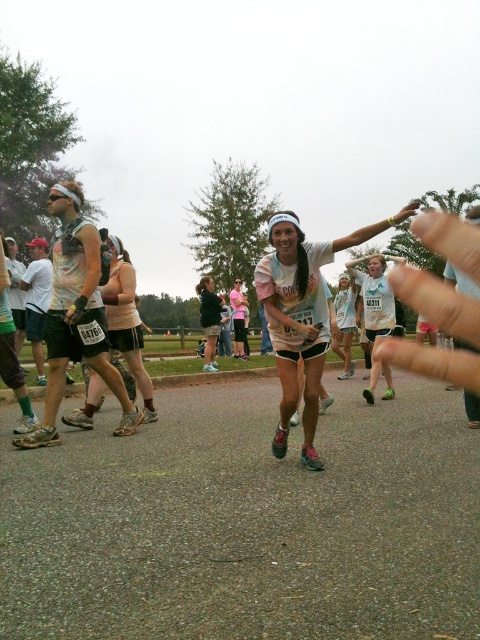
Is rainbow tie-dye shirt at center above matte tie-dye tank top at left?

No, rainbow tie-dye shirt at center is not above matte tie-dye tank top at left.

Between rainbow tie-dye shirt at center and matte tie-dye tank top at left, which one appears on the right side from the viewer's perspective?

rainbow tie-dye shirt at center

Which is behind, point (280, 445) or point (86, 243)?

The point (86, 243) is more distant.

Locate an element on the screen. rainbow tie-dye shirt at center is located at coordinates (301, 316).